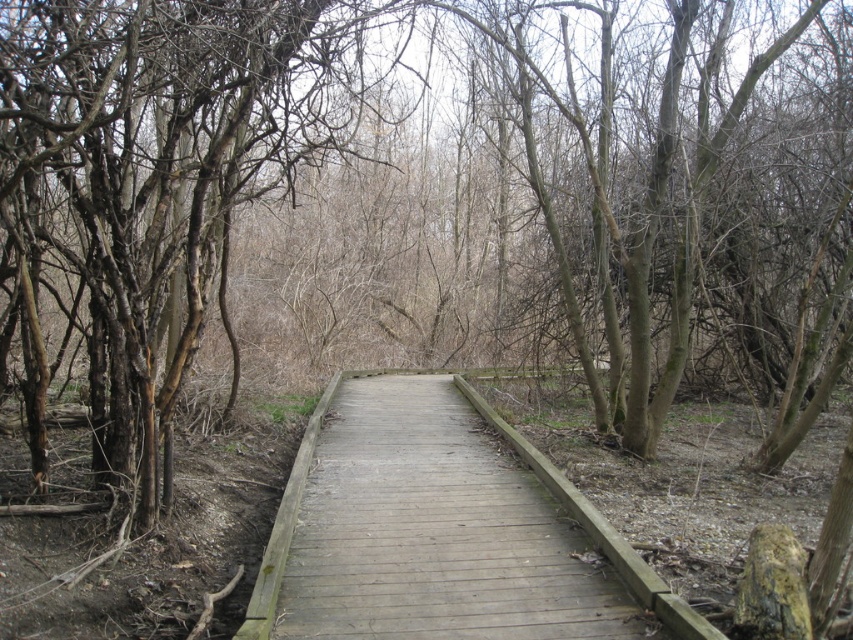
Find the location of a particular element. Image resolution: width=853 pixels, height=640 pixels. brown bark tree at left is located at coordinates (154, 180).

Does brown bark tree at left appear over wooden boardwalk at center?

Indeed, brown bark tree at left is positioned over wooden boardwalk at center.

Is point (103, 237) farther from camera compared to point (364, 488)?

No, it is in front of (364, 488).

Locate an element on the screen. The width and height of the screenshot is (853, 640). brown bark tree at left is located at coordinates (154, 180).